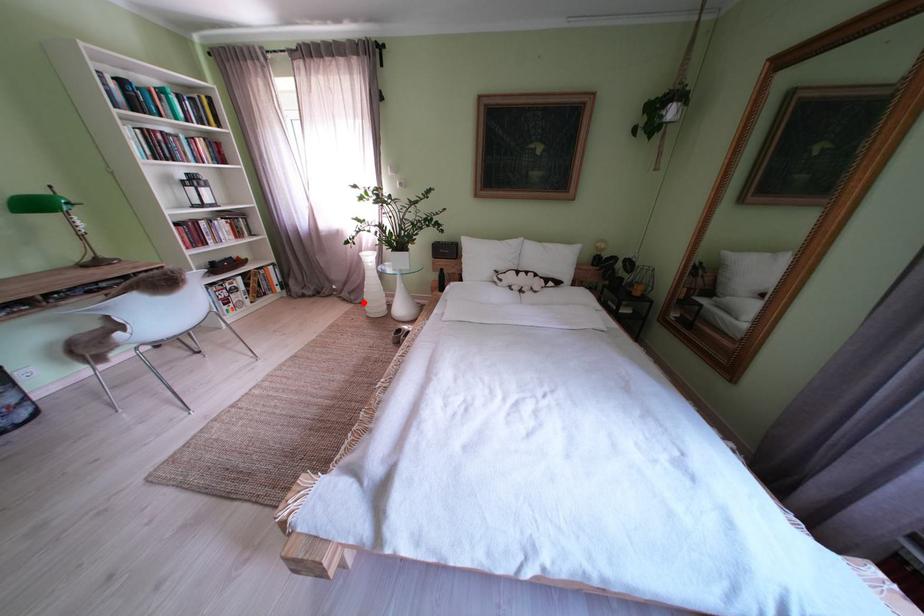
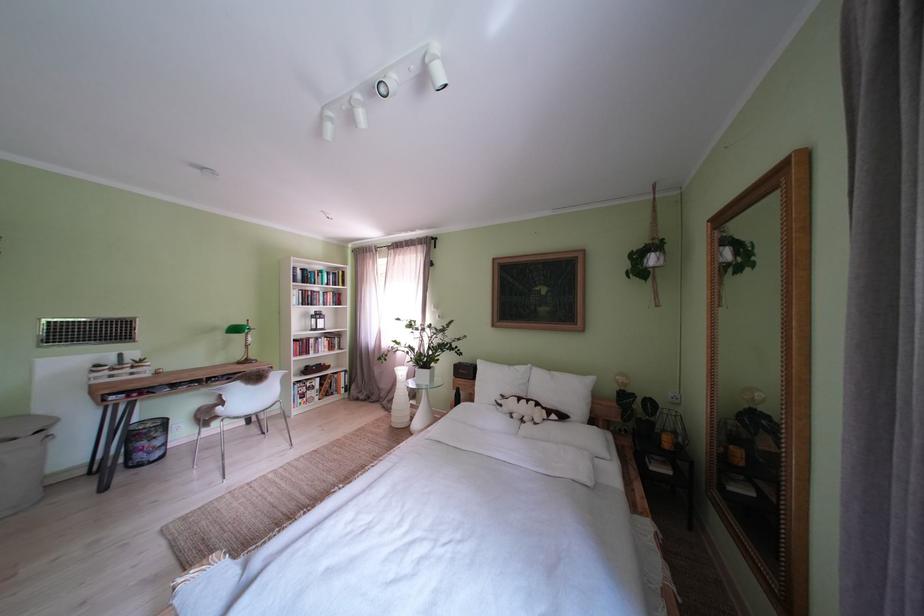
Question: A red point is marked in image1. In image2, is the corresponding 3D point closer to the camera or farther? Reply with the corresponding letter.

Choices:
 (A) The corresponding 3D point is closer.
 (B) The corresponding 3D point is farther.

Answer: (B)